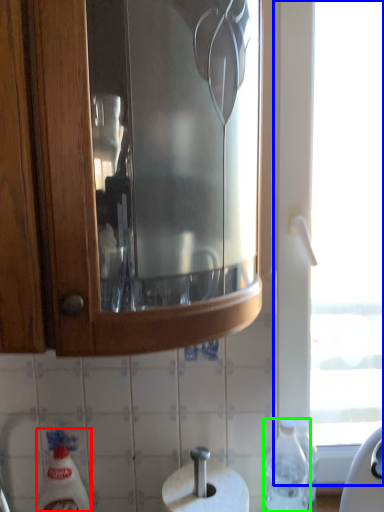
Question: Which object is the closest to the cleaning product (highlighted by a red box)? Choose among these: window (highlighted by a blue box) or bottle (highlighted by a green box).

Choices:
 (A) window
 (B) bottle

Answer: (B)